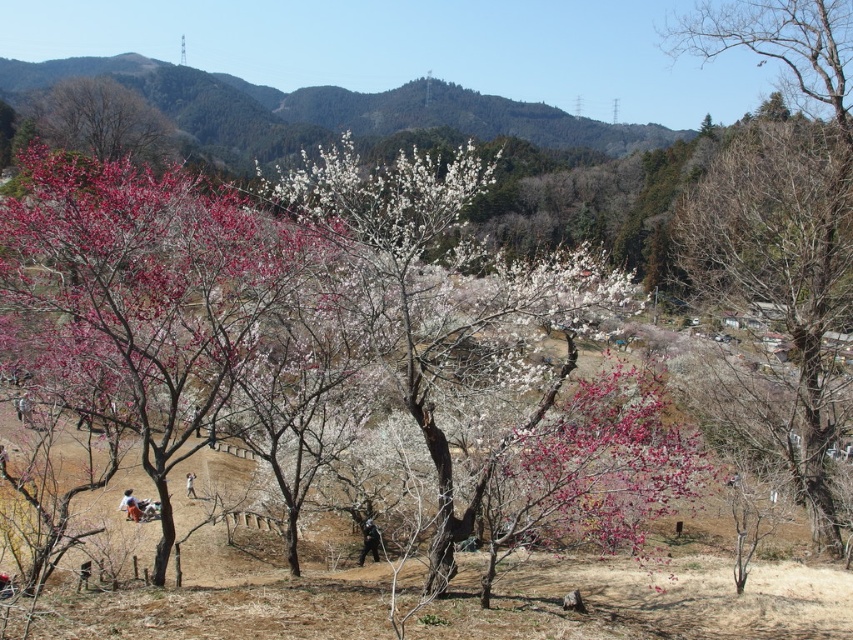
Looking at this image, you are standing at the point with coordinates point (192,493) and want to walk towards the point with coordinates point (556,534). Which direction should you move relative to your current position?

You should move forward because point (556,534) is in front of point (192,493).

You are standing in the serene landscape described, looking at the bare branches at right and the light blue denim jeans at lower center. Which object is positioned higher from the ground?

The bare branches at right is above the light blue denim jeans at lower center, so it is positioned higher from the ground.